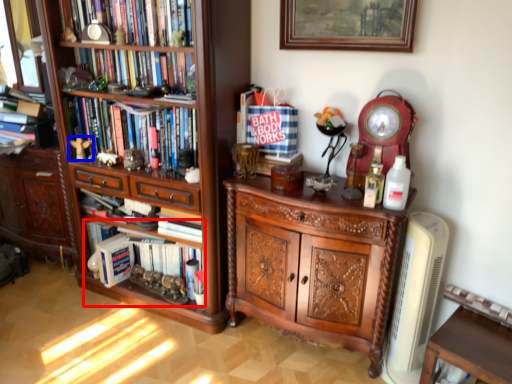
Question: Which object is further to the camera taking this photo, book (highlighted by a red box) or toy (highlighted by a blue box)?

Choices:
 (A) book
 (B) toy

Answer: (B)